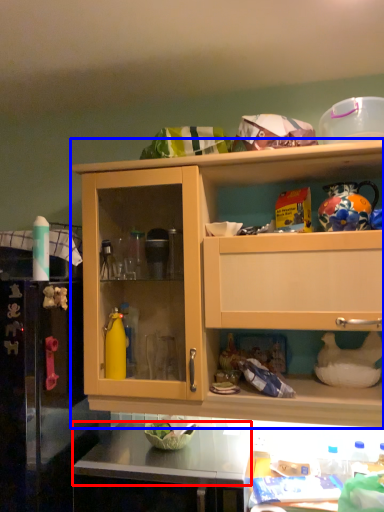
Question: Which of the following is the farthest to the observer, counter top (highlighted by a red box) or cabinetry (highlighted by a blue box)?

Choices:
 (A) counter top
 (B) cabinetry

Answer: (B)